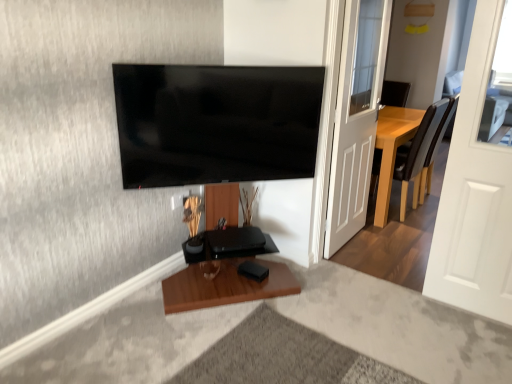
Question: Does flat screen tv at upper center have a lesser width compared to brown leather chair at right?

Choices:
 (A) yes
 (B) no

Answer: (A)

Question: Can you confirm if flat screen tv at upper center is taller than brown leather chair at right?

Choices:
 (A) yes
 (B) no

Answer: (B)

Question: Could you tell me if flat screen tv at upper center is facing brown leather chair at right?

Choices:
 (A) no
 (B) yes

Answer: (A)

Question: Is flat screen tv at upper center bigger than brown leather chair at right?

Choices:
 (A) no
 (B) yes

Answer: (A)

Question: Is flat screen tv at upper center not within brown leather chair at right?

Choices:
 (A) yes
 (B) no

Answer: (A)

Question: Is brown leather chair at right at the back of flat screen tv at upper center?

Choices:
 (A) yes
 (B) no

Answer: (B)

Question: Is white glossy door at right, which is counted as the first door, starting from the back, outside flat screen tv at upper center?

Choices:
 (A) yes
 (B) no

Answer: (A)

Question: Does white glossy door at right, the 2th door from the right, appear on the left side of flat screen tv at upper center?

Choices:
 (A) yes
 (B) no

Answer: (B)

Question: Is white glossy door at right, which is the first door from left to right, taller than flat screen tv at upper center?

Choices:
 (A) no
 (B) yes

Answer: (B)

Question: Is white glossy door at right, which is the first door from left to right, smaller than flat screen tv at upper center?

Choices:
 (A) no
 (B) yes

Answer: (A)

Question: Does white glossy door at right, the 2th door from the right, appear on the right side of flat screen tv at upper center?

Choices:
 (A) no
 (B) yes

Answer: (B)

Question: Can you confirm if white glossy door at right, marked as the second door in a front-to-back arrangement, is shorter than flat screen tv at upper center?

Choices:
 (A) no
 (B) yes

Answer: (A)

Question: Is white matte door at right, the 1th door from the right, beside flat screen tv at upper center?

Choices:
 (A) yes
 (B) no

Answer: (B)